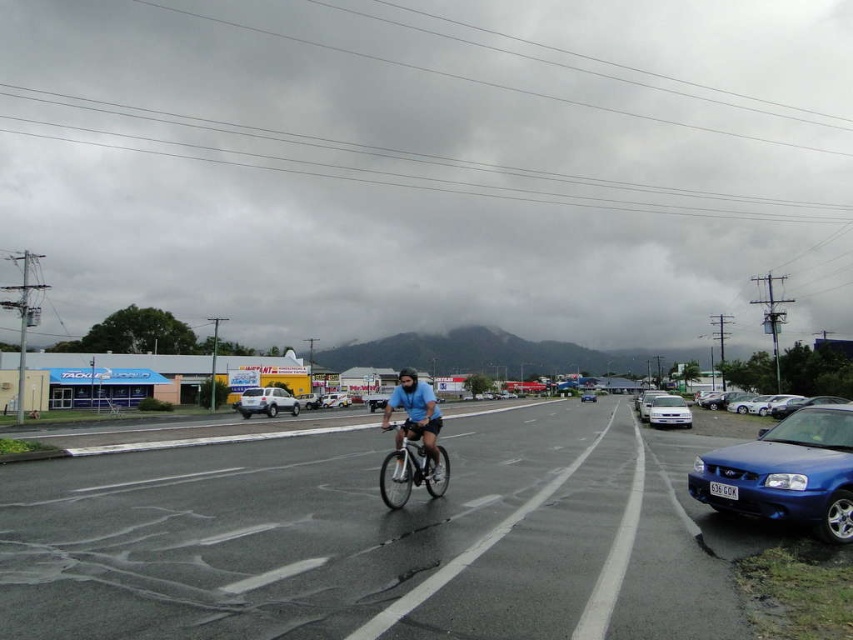
Describe the element at coordinates (431, 163) in the screenshot. I see `gray cloudy sky at upper center` at that location.

Does gray cloudy sky at upper center have a greater height compared to blue matte bicycle at center?

Yes, gray cloudy sky at upper center is taller than blue matte bicycle at center.

Locate an element on the screen. The height and width of the screenshot is (640, 853). gray cloudy sky at upper center is located at coordinates (431, 163).

Who is positioned more to the left, shiny metallic bicycle at center or satin silver suv at center-left?

From the viewer's perspective, satin silver suv at center-left appears more on the left side.

Locate an element on the screen. shiny metallic bicycle at center is located at coordinates pos(410,468).

Is metallic blue sedan at right wider than satin silver suv at center-left?

Incorrect, metallic blue sedan at right's width does not surpass satin silver suv at center-left's.

Can you confirm if metallic blue sedan at right is bigger than satin silver suv at center-left?

Incorrect, metallic blue sedan at right is not larger than satin silver suv at center-left.

Does point (799, 445) lie behind point (293, 413)?

No, it is in front of (293, 413).

Identify the location of metallic blue sedan at right. (786, 474).